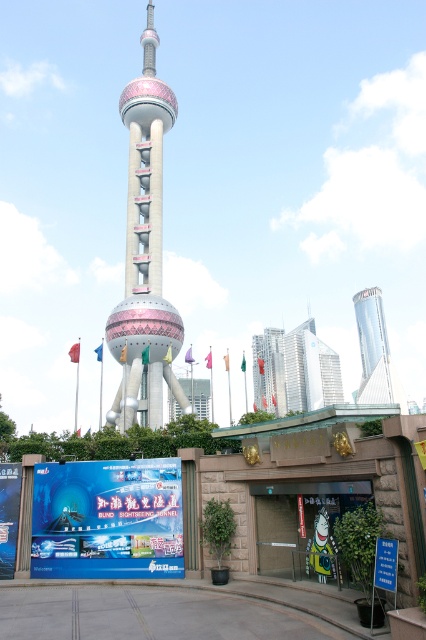
You are standing at the entrance of the BUND SIGHTSEEING TUNNEL and looking towards the Oriental Pearl Tower. There are two points marked in the scene. The first point is at coordinates point (114, 339) and the second is at point (276, 346). Which point is closer to your current position?

Point (114, 339) is closer to the camera than point (276, 346), so the first point is closer to your current position.

You are a tourist standing at the BUND SIGHTSEEING TUNNEL entrance. You see the polished concrete tower at center and the glassy reflective skyscraper at center. Which one is positioned to the left?

The polished concrete tower at center is positioned to the left of the glassy reflective skyscraper at center.

You are a tourist standing at the BUND SIGHTSEEING TUNNEL entrance. You see the polished concrete tower at center and the silver metallic skyscraper at center. Which structure is closer to you?

The polished concrete tower at center is closer to you because it is in front of the silver metallic skyscraper at center.